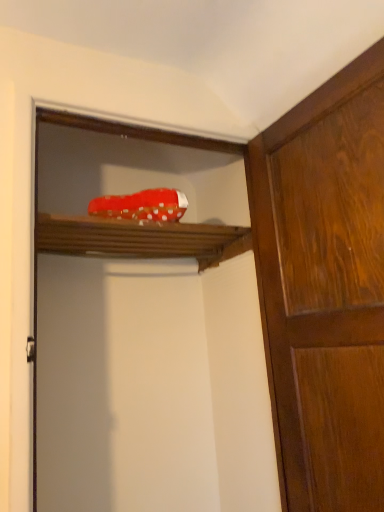
Question: From a real-world perspective, is wooden cabinet at right above or below red fabric shoe at upper center?

Choices:
 (A) above
 (B) below

Answer: (B)

Question: Is wooden cabinet at right wider or thinner than red fabric shoe at upper center?

Choices:
 (A) wide
 (B) thin

Answer: (B)

Question: Which object is the closest to the wooden shelf at upper center?

Choices:
 (A) red fabric shoe at upper center
 (B) wooden cabinet at right

Answer: (A)

Question: Which is farther from the wooden cabinet at right?

Choices:
 (A) red fabric shoe at upper center
 (B) wooden shelf at upper center

Answer: (B)